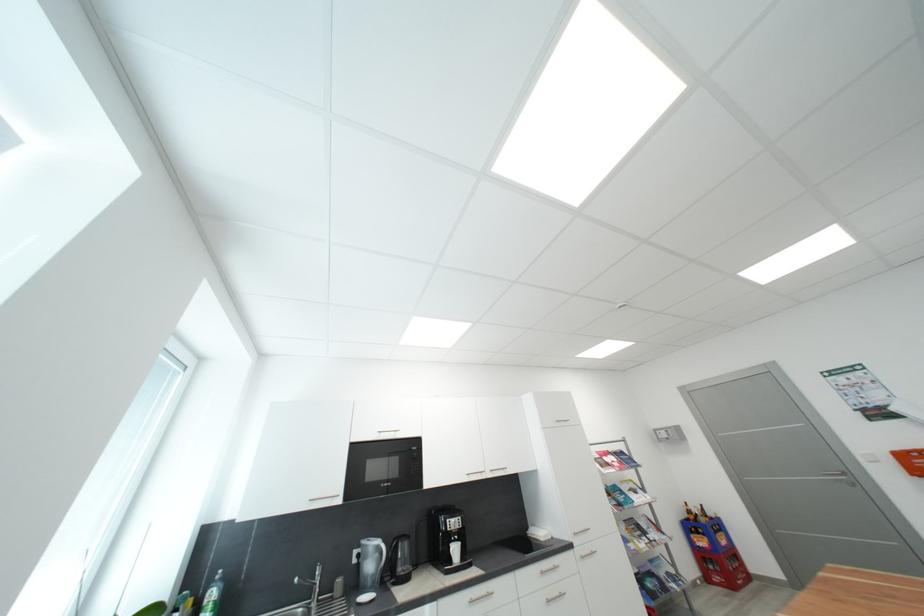
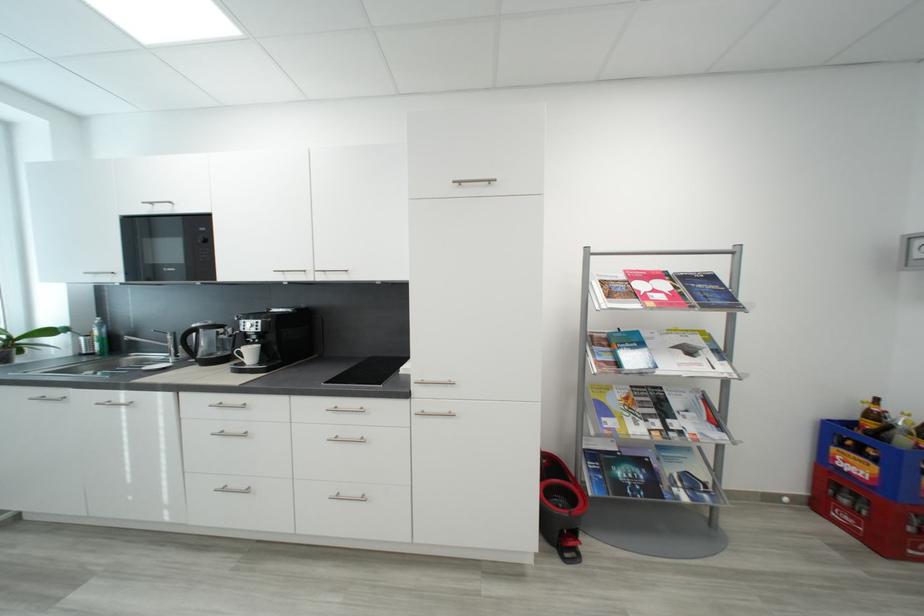
Find the pixel in the second image that matches the point at 629,454 in the first image.

(718, 280)